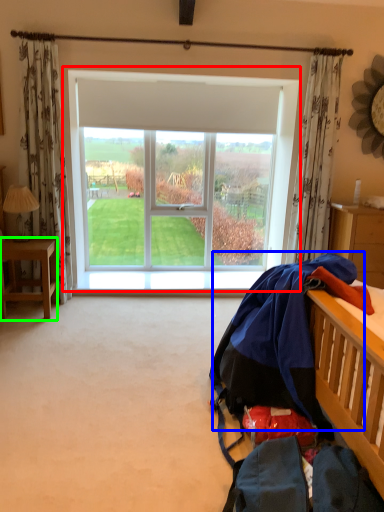
Question: Which is nearer to the window (highlighted by a red box)? clothing (highlighted by a blue box) or desk (highlighted by a green box).

Choices:
 (A) clothing
 (B) desk

Answer: (B)